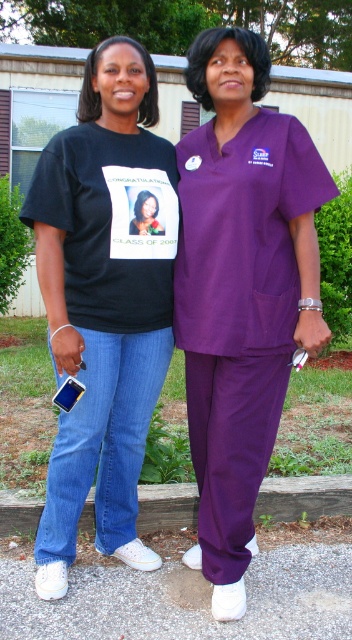
Can you confirm if black cotton t-shirt at left is positioned above wooden at lower center?

Indeed, black cotton t-shirt at left is positioned over wooden at lower center.

Is black cotton t-shirt at left shorter than wooden at lower center?

No, black cotton t-shirt at left is not shorter than wooden at lower center.

This screenshot has height=640, width=352. Identify the location of black cotton t-shirt at left. (103, 301).

Can you confirm if black cotton t-shirt at left is positioned above matte black t-shirt at center?

Incorrect, black cotton t-shirt at left is not positioned above matte black t-shirt at center.

Consider the image. Does black cotton t-shirt at left have a lesser width compared to matte black t-shirt at center?

No.

Locate an element on the screen. black cotton t-shirt at left is located at coordinates (103, 301).

Does wooden at lower center have a greater width compared to matte black t-shirt at center?

Yes.

Between point (278, 513) and point (153, 196), which one is positioned behind?

Positioned behind is point (278, 513).

Is point (32, 506) farther from camera compared to point (141, 196)?

Yes, point (32, 506) is farther from viewer.

The image size is (352, 640). Identify the location of wooden at lower center. (304, 497).